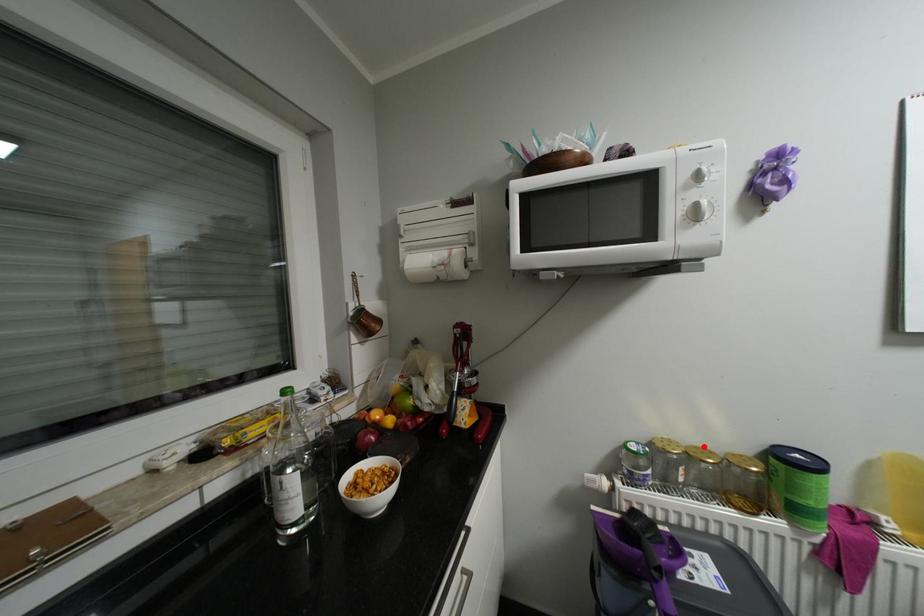
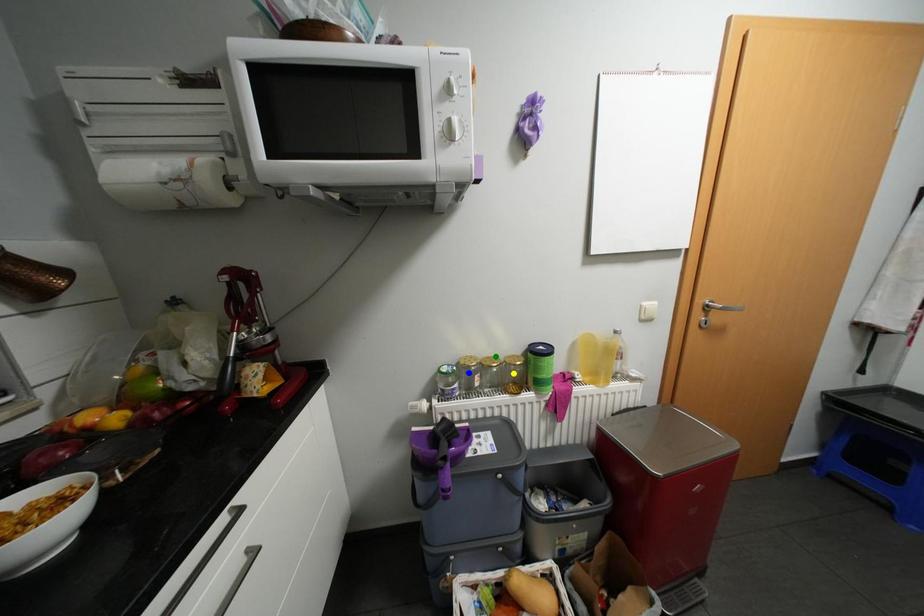
Question: I am providing you with two images of the same scene from different viewpoints. A red point is marked on the first image. You are given multiple points on the second image. In image 2, which mark is for the same physical point as the one in image 1?

Choices:
 (A) green point
 (B) blue point
 (C) yellow point

Answer: (A)